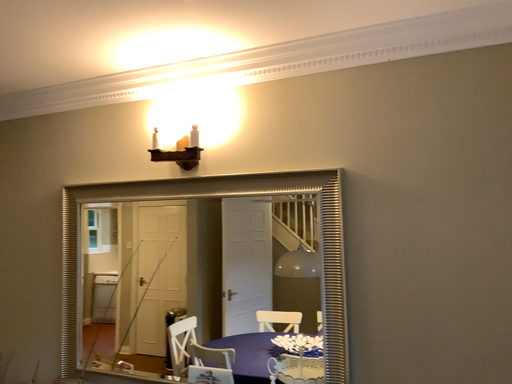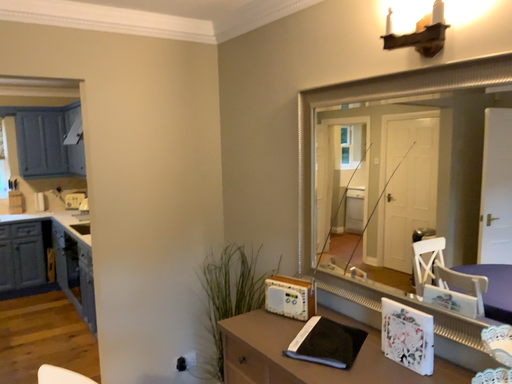
Question: How did the camera likely rotate when shooting the video?

Choices:
 (A) rotated right
 (B) rotated left

Answer: (B)